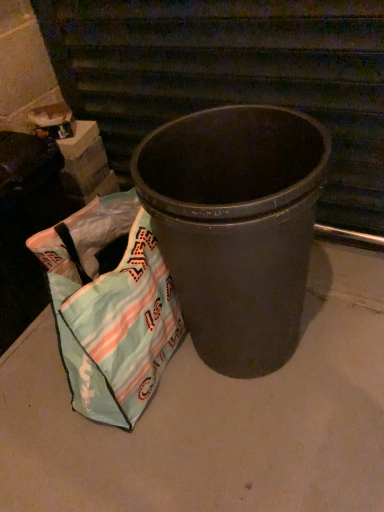
Question: From a real-world perspective, is textured fabric bag at lower left located higher than matte gray concrete at center?

Choices:
 (A) no
 (B) yes

Answer: (B)

Question: Does textured fabric bag at lower left have a lesser height compared to matte gray concrete at center?

Choices:
 (A) yes
 (B) no

Answer: (B)

Question: From the image's perspective, is textured fabric bag at lower left beneath matte gray concrete at center?

Choices:
 (A) yes
 (B) no

Answer: (B)

Question: From a real-world perspective, is textured fabric bag at lower left below matte gray concrete at center?

Choices:
 (A) yes
 (B) no

Answer: (B)

Question: Is textured fabric bag at lower left positioned with its back to matte gray concrete at center?

Choices:
 (A) no
 (B) yes

Answer: (A)

Question: Considering the relative sizes of textured fabric bag at lower left and matte gray concrete at center in the image provided, is textured fabric bag at lower left thinner than matte gray concrete at center?

Choices:
 (A) no
 (B) yes

Answer: (B)

Question: From the image's perspective, is matte black trash can at center under textured fabric bag at lower left?

Choices:
 (A) no
 (B) yes

Answer: (A)

Question: From the image's perspective, is matte black trash can at center on textured fabric bag at lower left?

Choices:
 (A) yes
 (B) no

Answer: (A)

Question: Is matte black trash can at center aimed at textured fabric bag at lower left?

Choices:
 (A) yes
 (B) no

Answer: (B)

Question: Considering the relative positions of matte black trash can at center and textured fabric bag at lower left in the image provided, is matte black trash can at center in front of textured fabric bag at lower left?

Choices:
 (A) yes
 (B) no

Answer: (A)

Question: Is textured fabric bag at lower left inside matte black trash can at center?

Choices:
 (A) no
 (B) yes

Answer: (A)

Question: Does matte black trash can at center have a lesser width compared to textured fabric bag at lower left?

Choices:
 (A) yes
 (B) no

Answer: (B)

Question: From the image's perspective, would you say textured fabric bag at lower left is shown under matte black trash can at center?

Choices:
 (A) yes
 (B) no

Answer: (A)